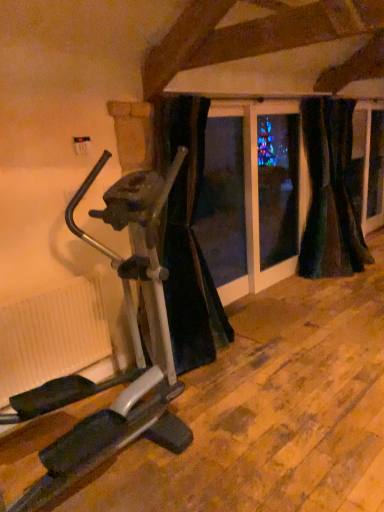
The height and width of the screenshot is (512, 384). In order to click on free space to the right of silver metallic stationary bicycle at left in this screenshot , I will do `click(265, 442)`.